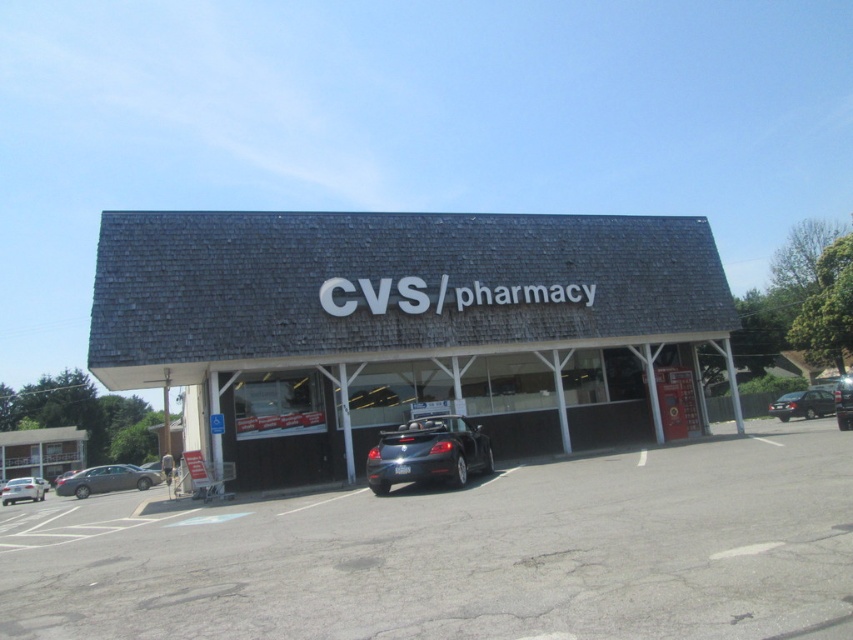
Who is more forward, (479, 241) or (19, 500)?

Positioned in front is point (479, 241).

Locate an element on the screen. The width and height of the screenshot is (853, 640). gray shingles cvs/pharmacy at center is located at coordinates (407, 326).

Is point (425, 460) positioned behind point (44, 480)?

No, (425, 460) is closer to viewer.

Does shiny black convertible at center have a greater width compared to silver metallic sedan at lower left?

In fact, shiny black convertible at center might be narrower than silver metallic sedan at lower left.

The width and height of the screenshot is (853, 640). In order to click on shiny black convertible at center in this screenshot , I will do `click(428, 452)`.

Between gray shingles cvs/pharmacy at center and satin black sedan at right, which one is positioned higher?

gray shingles cvs/pharmacy at center is higher up.

From the picture: Is gray shingles cvs/pharmacy at center positioned at the back of satin black sedan at right?

No, it is in front of satin black sedan at right.

Where is `gray shingles cvs/pharmacy at center`? gray shingles cvs/pharmacy at center is located at coordinates (407, 326).